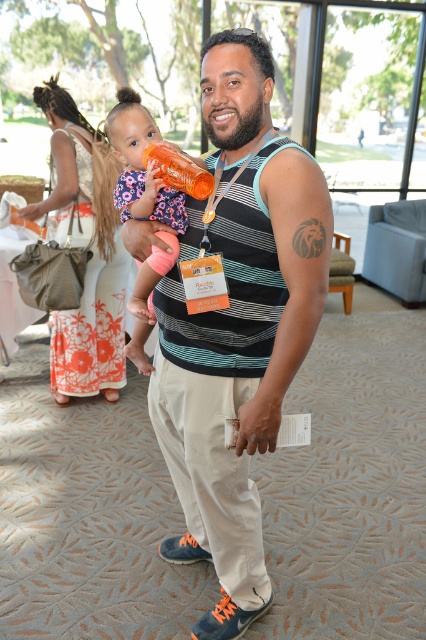
You are at a reunion event and need to greet two people wearing the striped tank top at center and the floral fabric dress at center. If you are standing at the entrance of the room, which one is closer to you?

The striped tank top at center is 6.37 feet away from the floral fabric dress at center. Since both are at the center, they are equidistant from the entrance. However, the distance between them is 6.37 feet, so you need to check their exact positions relative to the entrance to determine which is closer.